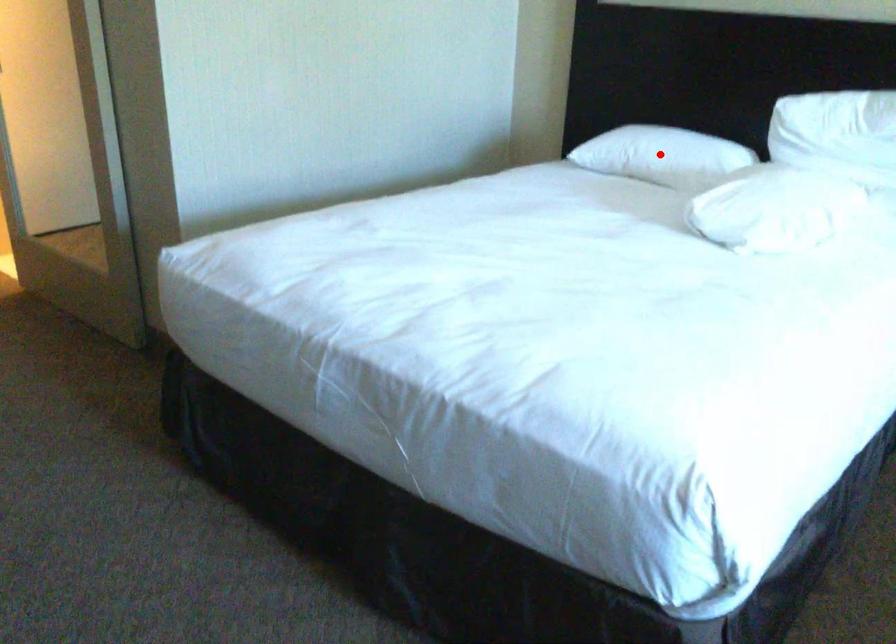
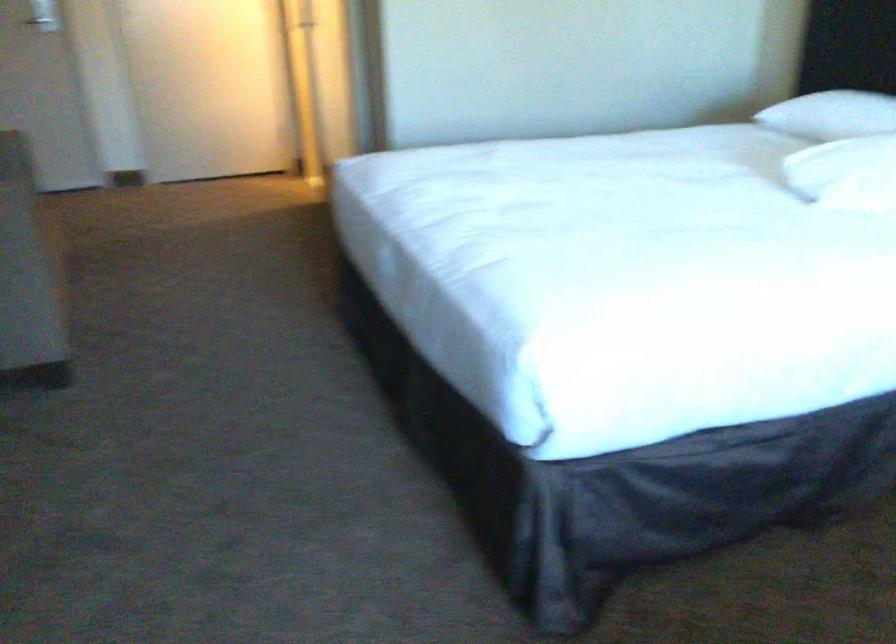
Locate, in the second image, the point that corresponds to the highlighted location in the first image.

(831, 115)